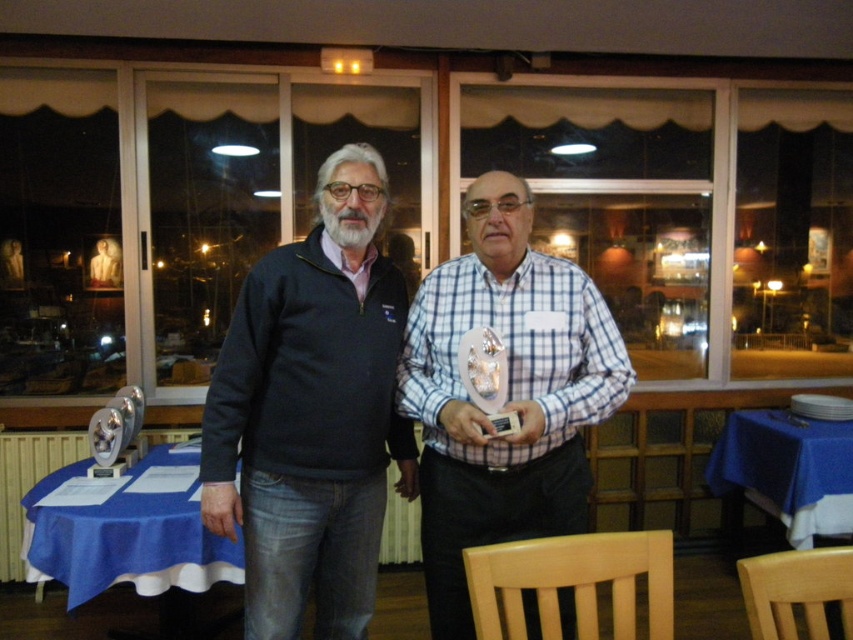
Who is taller, white checkered shirt at center or blue fabric table at lower left?

white checkered shirt at center

Does white checkered shirt at center appear on the left side of blue fabric table at lower left?

No, white checkered shirt at center is not to the left of blue fabric table at lower left.

Who is more distant from viewer, (517, 241) or (27, 566)?

The point (27, 566) is behind.

Image resolution: width=853 pixels, height=640 pixels. I want to click on white checkered shirt at center, so click(508, 394).

Who is positioned more to the left, dark blue sweater at center or blue fabric table at lower left?

blue fabric table at lower left is more to the left.

Does dark blue sweater at center appear under blue fabric table at lower left?

No, dark blue sweater at center is not below blue fabric table at lower left.

Does point (252, 387) come farther from viewer compared to point (207, 568)?

No, it is in front of (207, 568).

Image resolution: width=853 pixels, height=640 pixels. What are the coordinates of `dark blue sweater at center` in the screenshot? It's located at (312, 412).

The width and height of the screenshot is (853, 640). I want to click on dark blue sweater at center, so click(x=312, y=412).